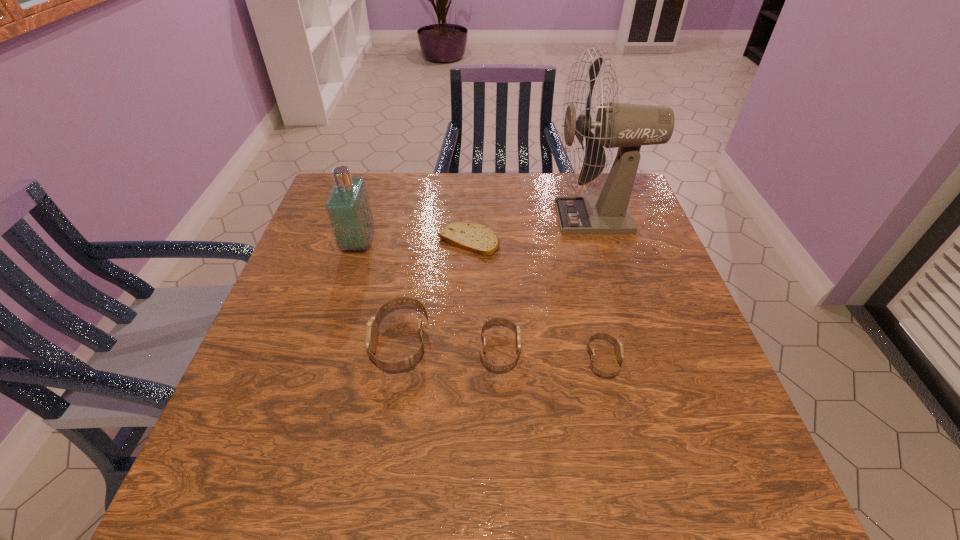
At what (x,y) coordinates should I click in order to perform the action: click on free point between the tallest watch and the tallest object. Please return your answer as a coordinate pair (x, y). Looking at the image, I should click on (498, 280).

Identify the location of blank region between the rightmost watch and the shortest object. The width and height of the screenshot is (960, 540). (536, 301).

I want to click on vacant region between the third shortest object and the second shortest object, so click(552, 355).

The width and height of the screenshot is (960, 540). I want to click on empty location between the leftmost object and the second watch from left to right, so click(429, 297).

You are a GUI agent. You are given a task and a screenshot of the screen. Output one action in this format:
    pyautogui.click(x=<x>, y=<y>)
    Task: Click on the free space between the shortest object and the leftmost object
    
    Given the screenshot: What is the action you would take?
    [414, 242]

The width and height of the screenshot is (960, 540). I want to click on vacant space in between the pita bread and the leftmost watch, so click(x=435, y=292).

In order to click on object that stands as the closest to the leftmost watch in this screenshot , I will do `click(491, 321)`.

Locate an element on the screen. This screenshot has height=540, width=960. object that stands as the second closest to the leftmost object is located at coordinates (371, 332).

At what (x,y) coordinates should I click in order to perform the action: click on watch that is the closest to the leftmost watch. Please return your answer as a coordinate pair (x, y). This screenshot has height=540, width=960. Looking at the image, I should click on (491, 321).

Identify which watch is the second closest to the second tallest watch. Please provide its 2D coordinates. Your answer should be formatted as a tuple, i.e. [(x, y)], where the tuple contains the x and y coordinates of a point satisfying the conditions above.

[(619, 350)]